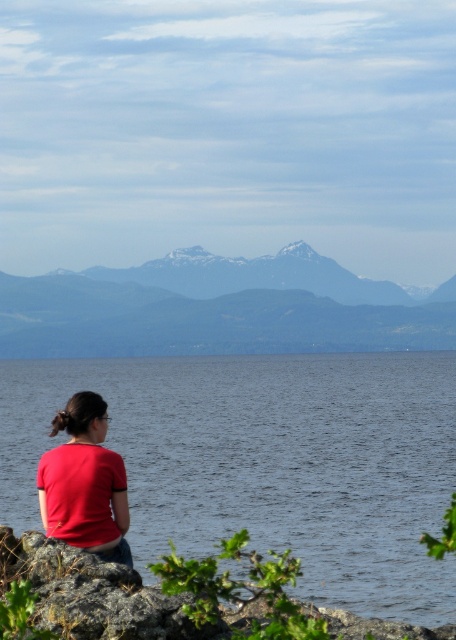
Can you confirm if snowy rocky mountain at center is taller than matte red shirt at lower left?

Yes, snowy rocky mountain at center is taller than matte red shirt at lower left.

Does point (175, 307) come farther from viewer compared to point (79, 486)?

Yes, it is behind point (79, 486).

Find the location of `snowy rocky mountain at center`. snowy rocky mountain at center is located at coordinates (216, 308).

Image resolution: width=456 pixels, height=640 pixels. What are the coordinates of `blue water at center` in the screenshot? It's located at (267, 461).

Can you confirm if blue water at center is taller than snowy rocky mountain at center?

In fact, blue water at center may be shorter than snowy rocky mountain at center.

This screenshot has width=456, height=640. I want to click on blue water at center, so click(x=267, y=461).

I want to click on blue water at center, so click(267, 461).

Can you confirm if blue water at center is smaller than matte red shirt at lower left?

No, blue water at center is not smaller than matte red shirt at lower left.

Which is more to the right, blue water at center or matte red shirt at lower left?

blue water at center

Is point (255, 394) positioned before point (123, 477)?

No.

This screenshot has width=456, height=640. Find the location of `blue water at center`. blue water at center is located at coordinates (267, 461).